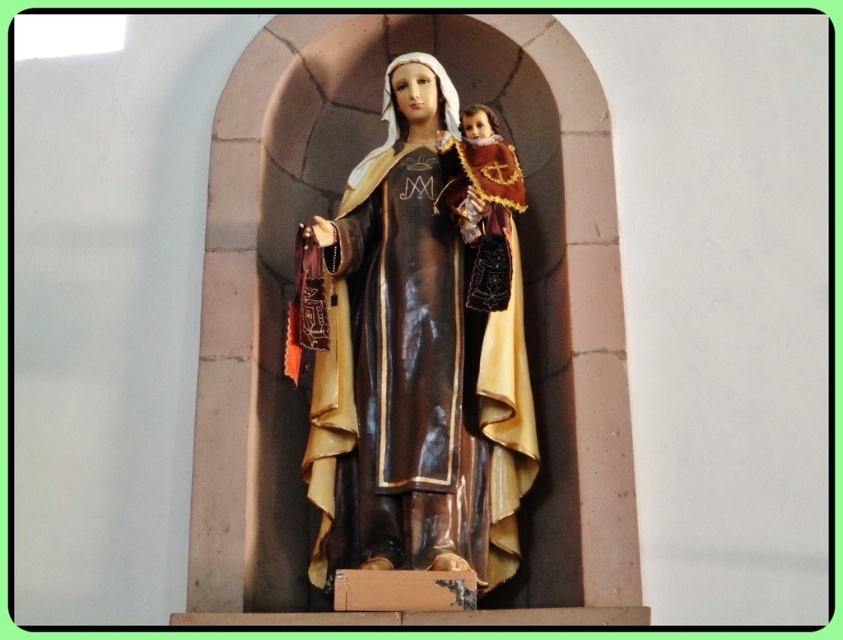
Describe the element at coordinates (422, 346) in the screenshot. I see `matte brown statue at center` at that location.

Which is behind, point (444, 193) or point (447, 196)?

Point (444, 193)

Does point (401, 212) lie behind point (487, 180)?

Yes, point (401, 212) is behind point (487, 180).

I want to click on matte brown statue at center, so click(422, 346).